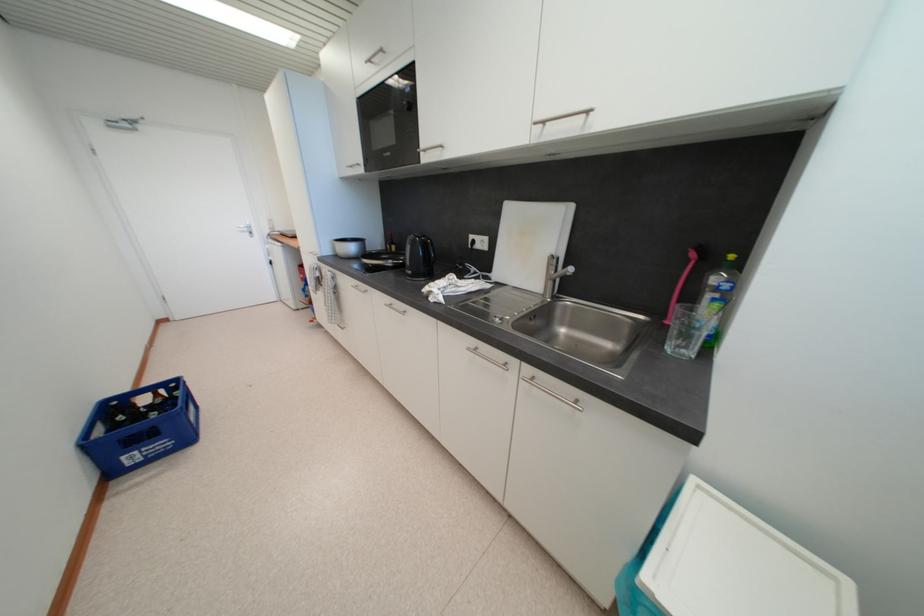
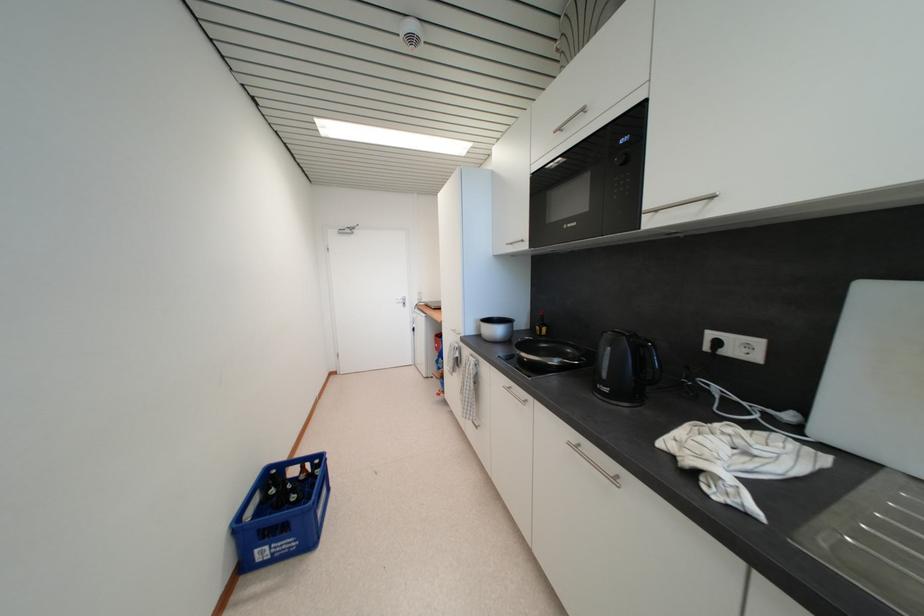
In a continuous first-person perspective shot, in which direction is the camera moving?

The movement direction of the cameraman is left, forward.